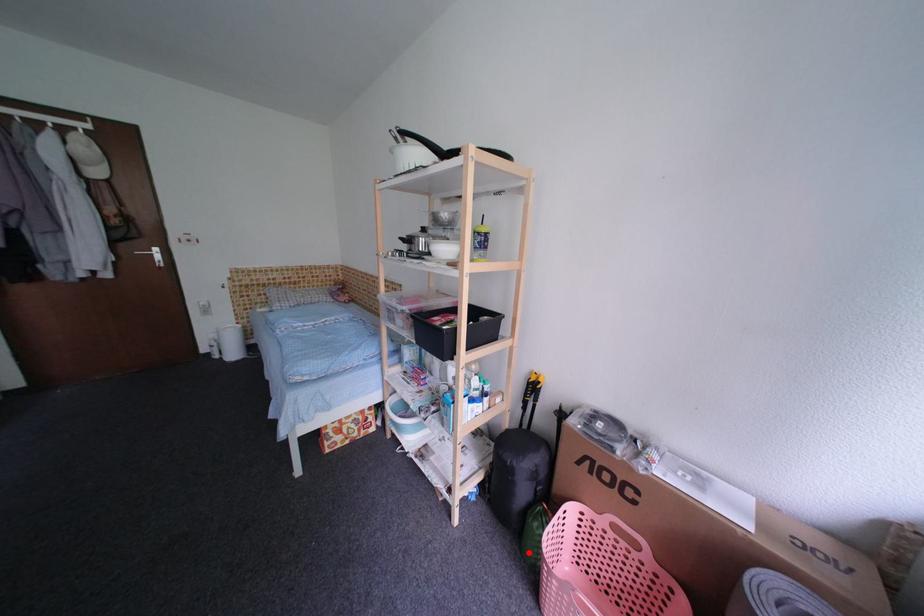
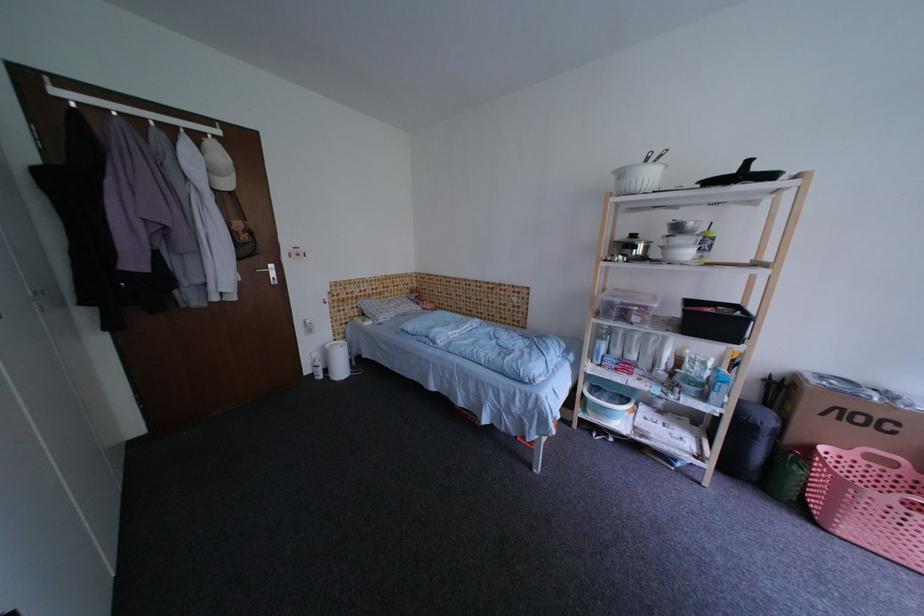
Find the pixel in the second image that matches the highlighted location in the first image.

(776, 496)